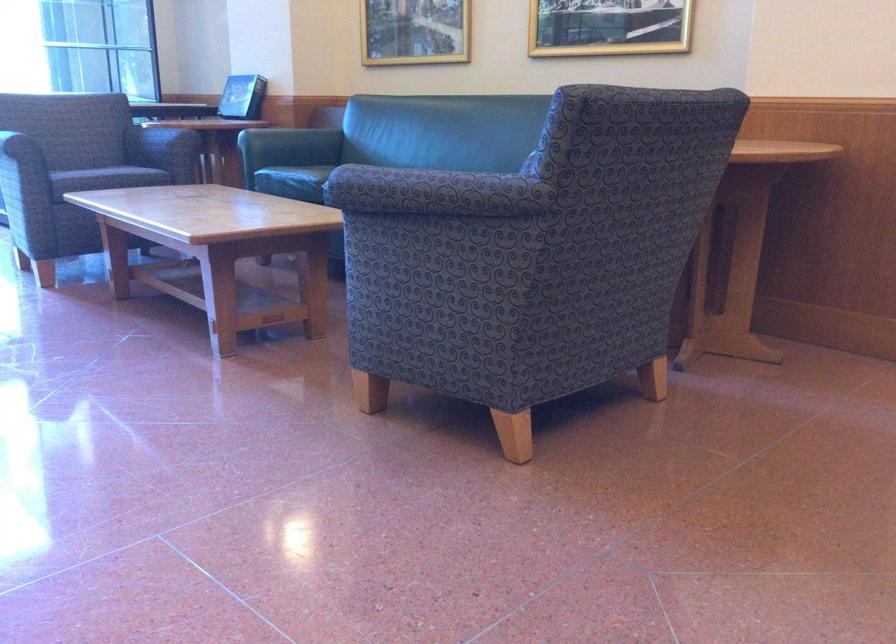
Where would you sit the chair sitting surface? Please return your answer as a coordinate pair (x, y).

(115, 176)